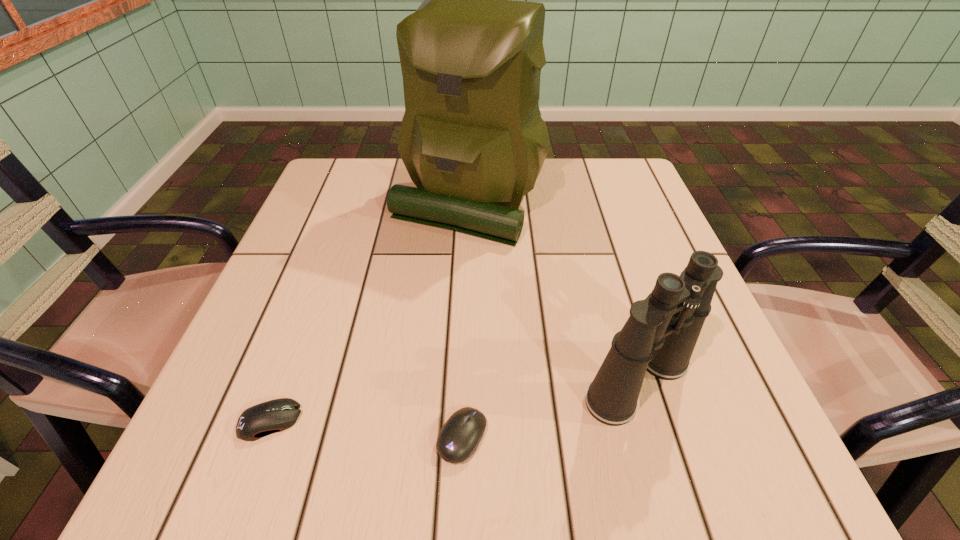
Where is `object that is positioned at the far edge`? object that is positioned at the far edge is located at coordinates (472, 139).

This screenshot has width=960, height=540. Identify the location of object at the left edge. (277, 415).

Where is `object situated at the right edge`? object situated at the right edge is located at coordinates (660, 335).

Where is `object at the near left corner`? object at the near left corner is located at coordinates (277, 415).

Image resolution: width=960 pixels, height=540 pixels. In the image, there is a desktop. Find the location of `vacant space at the far edge`. vacant space at the far edge is located at coordinates (391, 178).

You are a GUI agent. You are given a task and a screenshot of the screen. Output one action in this format:
    pyautogui.click(x=<x>, y=<y>)
    Task: Click on the vacant area at the near edge of the desktop
    The image size is (960, 540).
    Given the screenshot: What is the action you would take?
    pyautogui.click(x=543, y=446)

Find the location of a particular element. vacant region at the left edge of the desktop is located at coordinates (332, 214).

At what (x,y) coordinates should I click in order to perform the action: click on vacant space at the right edge of the desktop. Please return your answer as a coordinate pair (x, y). Looking at the image, I should click on (743, 402).

Locate an element on the screen. Image resolution: width=960 pixels, height=540 pixels. free space at the far left corner is located at coordinates (364, 158).

In the image, there is a desktop. Where is `free space at the far right corner`? This screenshot has width=960, height=540. free space at the far right corner is located at coordinates (633, 204).